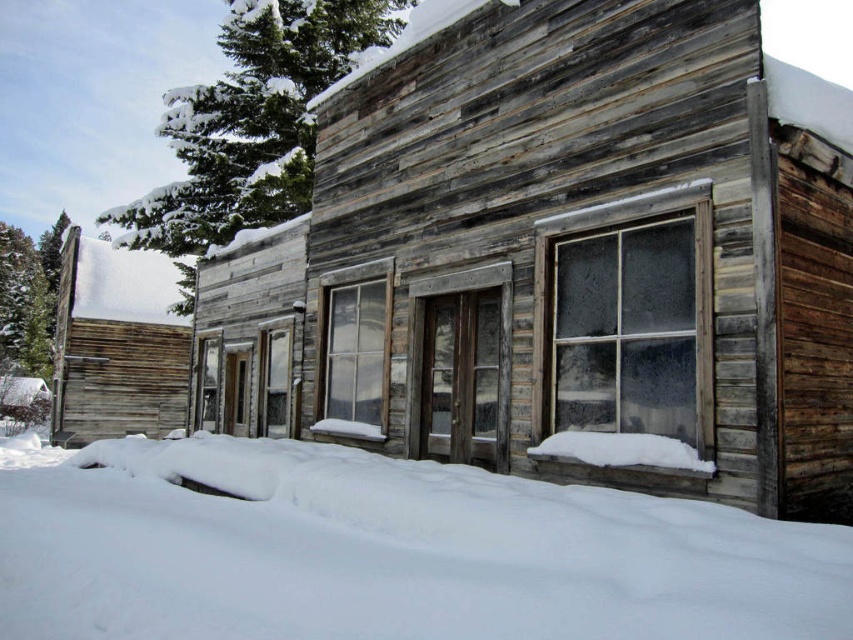
You are standing at the entrance of the rustic wooden building and want to walk to the point marked as point (165, 301). However, there is an obstacle at point (90, 500). Will you need to go around the obstacle to reach your destination?

Yes, you will need to go around the obstacle at point (90, 500) because it is in front of point (165, 301), meaning the obstacle is blocking the direct path to your destination.

You are standing in front of the weathered wood cabin at left and want to walk to the white fluffy snow at lower center. Is the snow in a reachable direction from the cabin?

The white fluffy snow at lower center is in front of the weathered wood cabin at left, so yes, the snow is directly in front of the cabin and reachable by walking forward.

You are standing in front of the rustic wooden building and want to place a small wooden bench. The bench requires a clear space of 1 meter by 1 meter. Based on the scene description, is there enough space at the location marked by point (390,554) for the bench?

The location at point (390,554) has white fluffy snow at lower center, which indicates there is clear space available. Since the snow is present and undisturbed, it suggests that the area is free of obstructions. Therefore, the 1 meter by 1 meter bench should fit there.